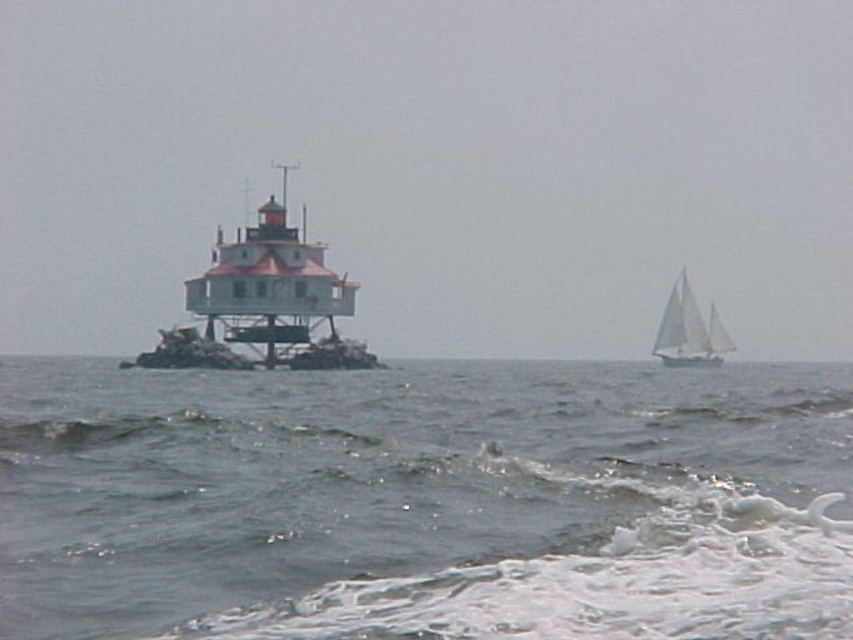
Is white painted wood lighthouse at center taller than white sailboat at right?

Correct, white painted wood lighthouse at center is much taller as white sailboat at right.

Does white painted wood lighthouse at center have a larger size compared to white sailboat at right?

Correct, white painted wood lighthouse at center is larger in size than white sailboat at right.

Between point (225, 259) and point (703, 340), which one is positioned behind?

Point (703, 340)

You are a GUI agent. You are given a task and a screenshot of the screen. Output one action in this format:
    pyautogui.click(x=<x>, y=<y>)
    Task: Click on the white painted wood lighthouse at center
    This screenshot has width=853, height=640.
    Given the screenshot: What is the action you would take?
    pyautogui.click(x=276, y=291)

Can you confirm if gray water at center is taller than white painted wood lighthouse at center?

In fact, gray water at center may be shorter than white painted wood lighthouse at center.

Is gray water at center smaller than white painted wood lighthouse at center?

Yes, gray water at center is smaller than white painted wood lighthouse at center.

This screenshot has width=853, height=640. I want to click on gray water at center, so click(424, 500).

Which is more to the left, gray water at center or white sailboat at right?

From the viewer's perspective, gray water at center appears more on the left side.

Can you confirm if gray water at center is taller than white sailboat at right?

In fact, gray water at center may be shorter than white sailboat at right.

Describe the element at coordinates (424, 500) in the screenshot. The image size is (853, 640). I see `gray water at center` at that location.

This screenshot has width=853, height=640. In order to click on gray water at center in this screenshot , I will do `click(424, 500)`.